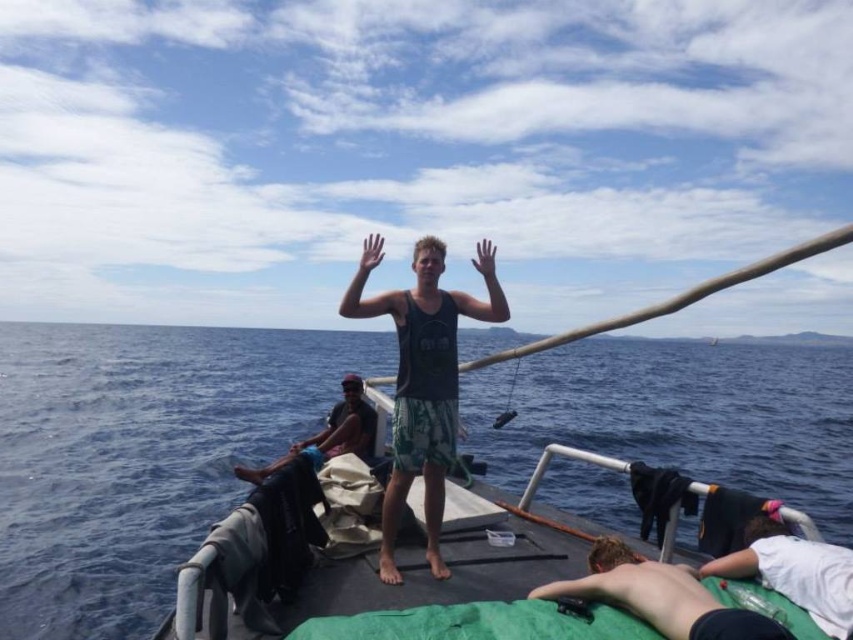
Question: Which point is closer to the camera?

Choices:
 (A) white cotton shirt at lower right
 (B) shiny skin at lower right
 (C) dark green fabric at center

Answer: (B)

Question: Is blue water at center further to the viewer compared to dark green fabric at center?

Choices:
 (A) no
 (B) yes

Answer: (A)

Question: Can you confirm if white cotton shirt at lower right is positioned below dark green fabric at center?

Choices:
 (A) no
 (B) yes

Answer: (A)

Question: Which point is closer to the camera taking this photo?

Choices:
 (A) (439, 323)
 (B) (642, 586)
 (C) (329, 449)

Answer: (B)

Question: Which of the following is the closest to the observer?

Choices:
 (A) white cotton shirt at lower right
 (B) dark green fabric at center

Answer: (A)

Question: Does blue water at center have a greater width compared to white cotton shirt at lower right?

Choices:
 (A) yes
 (B) no

Answer: (A)